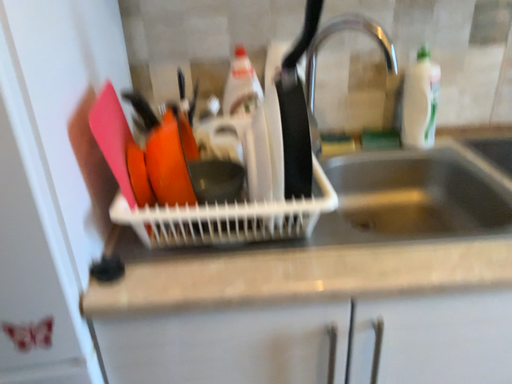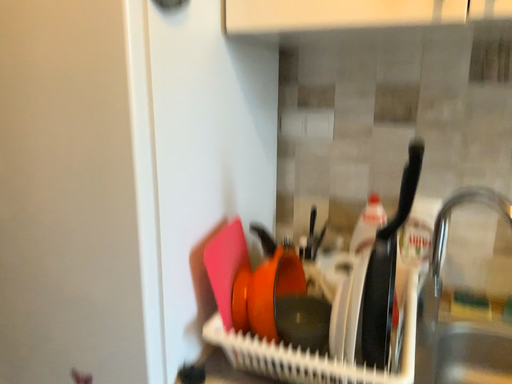
Question: Which way did the camera rotate in the video?

Choices:
 (A) rotated downward
 (B) rotated upward

Answer: (B)